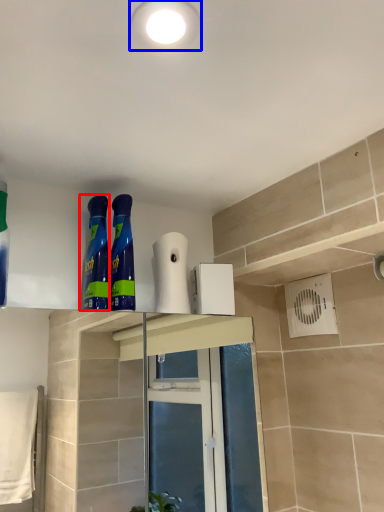
Question: Which point is further to the camera, cleaning product (highlighted by a red box) or lighting (highlighted by a blue box)?

Choices:
 (A) cleaning product
 (B) lighting

Answer: (A)